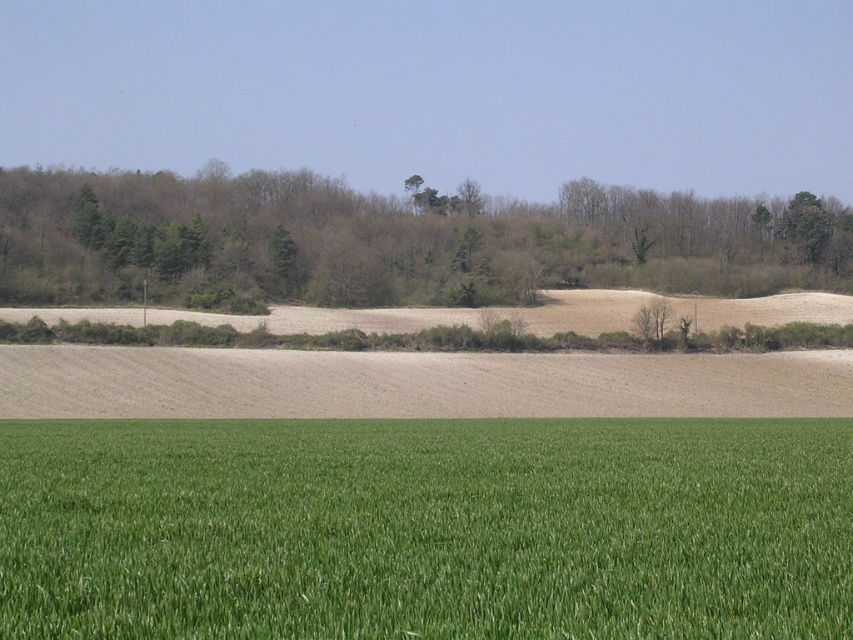
Question: Which of these objects is positioned closest to the green grass at lower center?

Choices:
 (A) brown soil at center
 (B) green leafy trees at upper center

Answer: (A)

Question: From the image, what is the correct spatial relationship of green grass at lower center in relation to brown soil at center?

Choices:
 (A) above
 (B) below

Answer: (A)

Question: Which is nearer to the brown soil at center?

Choices:
 (A) green leafy trees at upper center
 (B) green grass at lower center

Answer: (B)

Question: Is green grass at lower center positioned behind brown soil at center?

Choices:
 (A) yes
 (B) no

Answer: (B)

Question: Can you confirm if green grass at lower center is positioned to the left of brown soil at center?

Choices:
 (A) yes
 (B) no

Answer: (A)

Question: Estimate the real-world distances between objects in this image. Which object is closer to the green grass at lower center?

Choices:
 (A) brown soil at center
 (B) green leafy trees at upper center

Answer: (A)